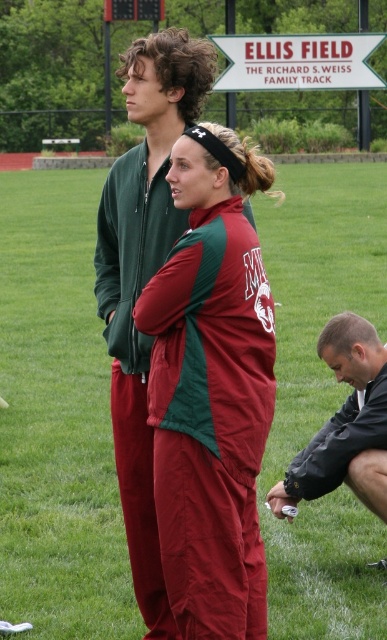
Question: Which point is farther from the camera taking this photo?

Choices:
 (A) (366, 573)
 (B) (299, 477)

Answer: (A)

Question: Is green grass at center below maroon fabric tracksuit at center?

Choices:
 (A) no
 (B) yes

Answer: (A)

Question: Which object is positioned farthest from the green grass at center?

Choices:
 (A) black matte jacket at lower right
 (B) maroon fabric tracksuit at center

Answer: (B)

Question: Which object is closer to the camera taking this photo?

Choices:
 (A) green grass at center
 (B) maroon fabric tracksuit at center

Answer: (B)

Question: Is maroon fabric tracksuit at center further to camera compared to black matte jacket at lower right?

Choices:
 (A) no
 (B) yes

Answer: (A)

Question: Can you confirm if green grass at center is positioned above maroon fabric tracksuit at center?

Choices:
 (A) no
 (B) yes

Answer: (B)